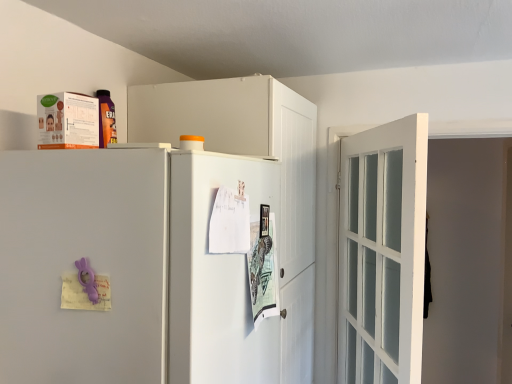
Question: Is white matte cabinet at upper center bigger or smaller than white matte refrigerator at center?

Choices:
 (A) big
 (B) small

Answer: (A)

Question: Relative to white matte refrigerator at center, is white matte cabinet at upper center in front or behind?

Choices:
 (A) behind
 (B) front

Answer: (A)

Question: Based on their relative distances, which object is nearer to the white matte refrigerator at center?

Choices:
 (A) white glass door at right
 (B) white matte cabinet at upper center
 (C) white glossy screen door at center

Answer: (C)

Question: Estimate the real-world distances between objects in this image. Which object is closer to the white matte refrigerator at center?

Choices:
 (A) white glossy screen door at center
 (B) white glass door at right
 (C) white matte cabinet at upper center

Answer: (A)